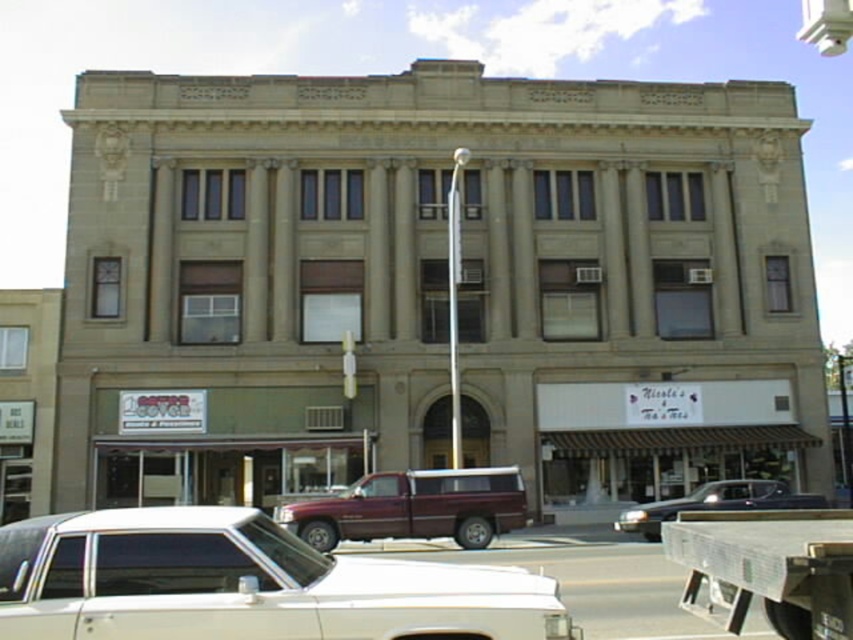
Question: Among these points, which one is farthest from the camera?

Choices:
 (A) (758, 592)
 (B) (311, 570)
 (C) (373, 474)

Answer: (C)

Question: Does maroon metallic pickup truck at center appear under metallic dark blue truck at center?

Choices:
 (A) no
 (B) yes

Answer: (A)

Question: Estimate the real-world distances between objects in this image. Which object is closer to the metallic silver truck bed at lower right?

Choices:
 (A) white glossy car at center
 (B) maroon metallic pickup truck at center
 (C) metallic dark blue truck at center

Answer: (A)

Question: Which of the following is the closest to the observer?

Choices:
 (A) (202, 596)
 (B) (786, 508)
 (C) (775, 534)
 (D) (419, 529)

Answer: (A)

Question: Does maroon metallic pickup truck at center appear on the right side of metallic dark blue truck at center?

Choices:
 (A) yes
 (B) no

Answer: (B)

Question: Is metallic silver truck bed at lower right wider than metallic dark blue truck at center?

Choices:
 (A) yes
 (B) no

Answer: (A)